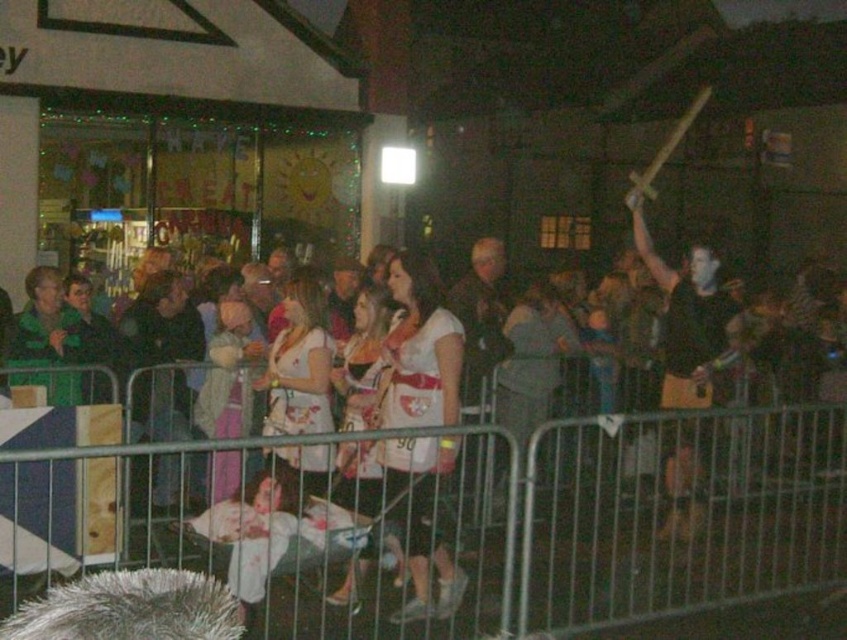
Which is more to the right, metal at center or white matte shirt at center?

metal at center

The image size is (847, 640). What are the coordinates of `metal at center` in the screenshot? It's located at (x=560, y=529).

Does point (641, 570) come farther from viewer compared to point (412, 467)?

Yes, it is behind point (412, 467).

Where is `metal at center`? metal at center is located at coordinates (560, 529).

Does metal at center have a lesser height compared to black matte shirt at upper right?

Correct, metal at center is not as tall as black matte shirt at upper right.

Which is behind, point (711, 532) or point (649, 237)?

Point (711, 532)

In order to click on metal at center in this screenshot , I will do `click(560, 529)`.

Does white matte shirt at center appear under black matte shirt at upper right?

Yes, white matte shirt at center is below black matte shirt at upper right.

Is white matte shirt at center to the right of black matte shirt at upper right from the viewer's perspective?

No, white matte shirt at center is not to the right of black matte shirt at upper right.

The width and height of the screenshot is (847, 640). Find the location of `white matte shirt at center`. white matte shirt at center is located at coordinates (419, 349).

Where is `white matte shirt at center`? The width and height of the screenshot is (847, 640). white matte shirt at center is located at coordinates (419, 349).